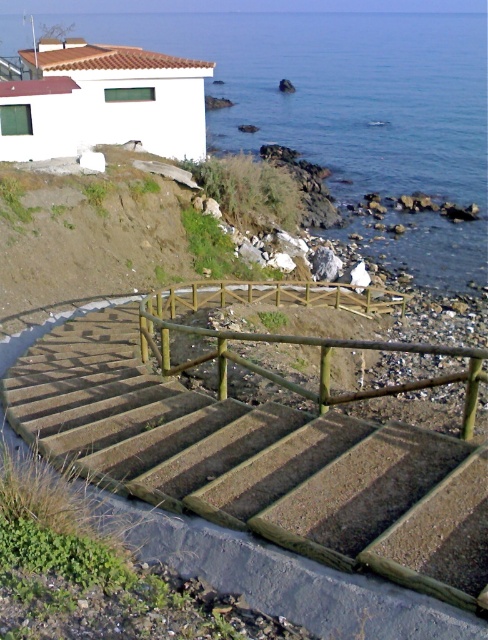
You are a hiker standing at the base of the staircase and want to reach the blue water at upper center. The wooden rail at center is blocking your path. Can you walk around it to reach the water?

The distance between the blue water at upper center and the wooden rail at center is 64.97 meters, so you can walk around the wooden rail at center to reach the blue water at upper center as there is enough space between them.

You are standing at the top of the curved staircase leading down to the sea. There is a point marked at coordinates point (286,579). Based on the scene description, where is this point located?

The point (286,579) is located on the concrete textured stairs at center.

You are a delivery person carrying a large box that is 3 meters wide. You need to navigate through the space between the concrete textured stairs at center and the wooden rail at center. Can your box fit through this space without touching either side?

The distance between the concrete textured stairs at center and the wooden rail at center is 2.75 meters. Since your box is 3 meters wide, it is wider than the available space. Therefore, the box cannot fit through the space between them without touching either side.